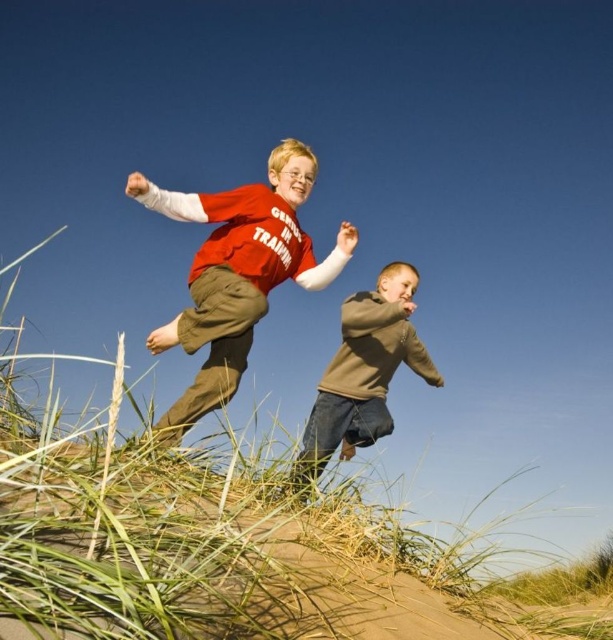
Between matte red shirt at center and brown cotton sweater at center, which one has less height?

Standing shorter between the two is brown cotton sweater at center.

Does matte red shirt at center have a greater height compared to brown cotton sweater at center?

Correct, matte red shirt at center is much taller as brown cotton sweater at center.

At what (x,y) coordinates should I click in order to perform the action: click on matte red shirt at center. Please return your answer as a coordinate pair (x, y). Image resolution: width=613 pixels, height=640 pixels. Looking at the image, I should click on 237,273.

Does green grass at lower left have a smaller size compared to matte red shirt at center?

Actually, green grass at lower left might be larger than matte red shirt at center.

Which is above, green grass at lower left or matte red shirt at center?

matte red shirt at center

Is point (126, 529) less distant than point (340, 236)?

Yes, it is.

The image size is (613, 640). What are the coordinates of `green grass at lower left` in the screenshot? It's located at (204, 541).

At what (x,y) coordinates should I click in order to perform the action: click on green grass at lower left. Please return your answer as a coordinate pair (x, y). This screenshot has width=613, height=640. Looking at the image, I should click on (204, 541).

Does green grass at lower left lie in front of brown cotton sweater at center?

That is True.

Is point (25, 525) in front of point (370, 387)?

Yes, it is in front of point (370, 387).

This screenshot has height=640, width=613. I want to click on green grass at lower left, so click(x=204, y=541).